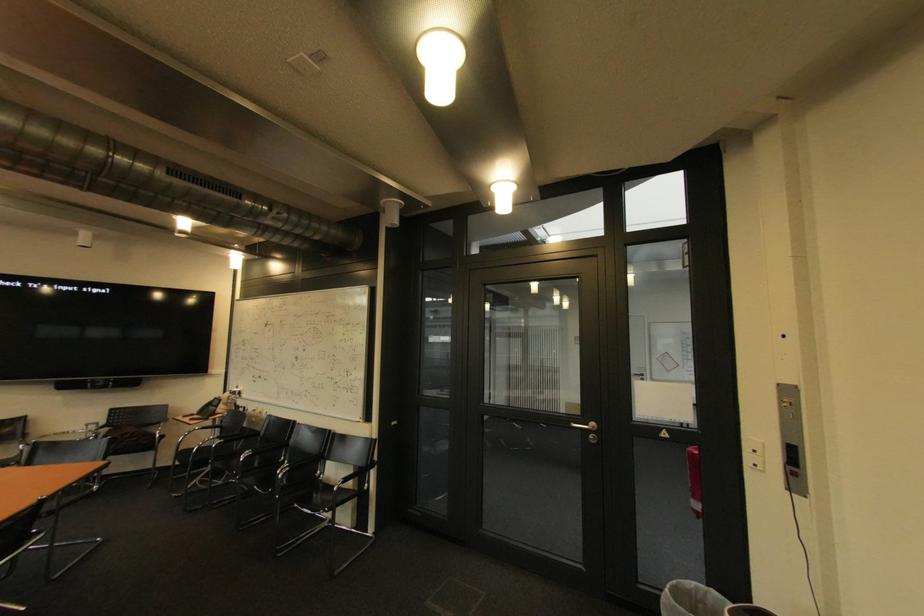
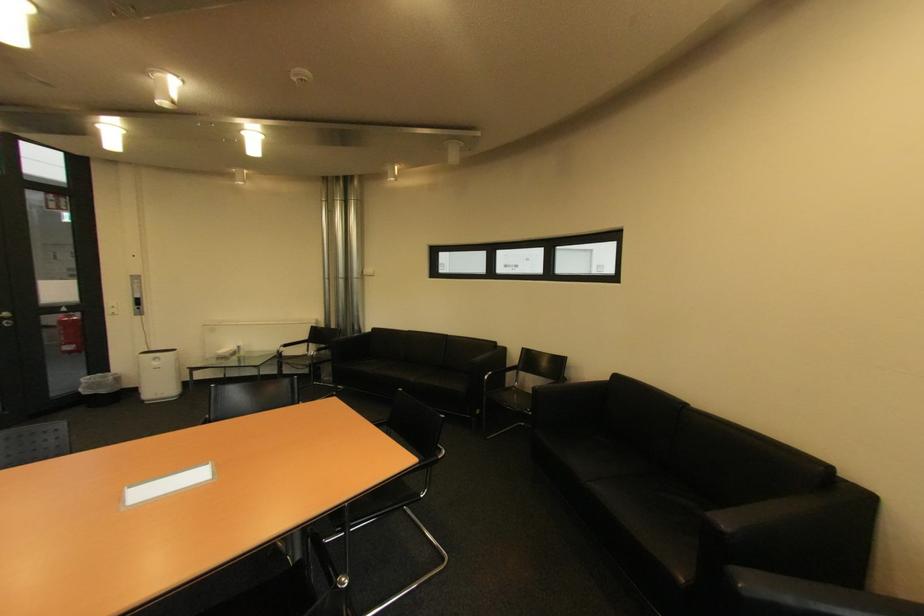
The point at (601, 426) is marked in the first image. Where is the corresponding point in the second image?

(14, 315)